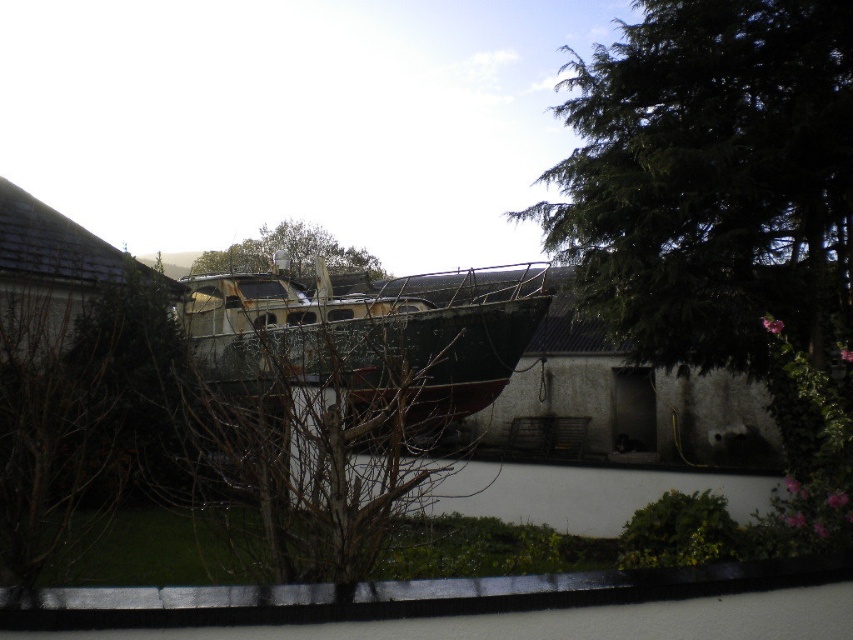
Question: Does green needle-like leaves at upper right have a smaller size compared to rusty metal boat at center?

Choices:
 (A) yes
 (B) no

Answer: (B)

Question: Does green needle-like leaves at upper right appear under brown rough bark tree at center?

Choices:
 (A) yes
 (B) no

Answer: (B)

Question: Which of the following is the farthest from the observer?

Choices:
 (A) green needle-like leaves at upper right
 (B) brown rough bark tree at center
 (C) rusty metal boat at center

Answer: (A)

Question: Does green needle-like leaves at upper right have a smaller size compared to brown rough bark tree at center?

Choices:
 (A) no
 (B) yes

Answer: (A)

Question: Among these points, which one is nearest to the camera?

Choices:
 (A) (329, 252)
 (B) (251, 378)

Answer: (B)

Question: Which object is positioned farthest from the brown rough bark tree at center?

Choices:
 (A) green leafy tree at center
 (B) rusty metal boat at center
 (C) green needle-like leaves at upper right

Answer: (A)